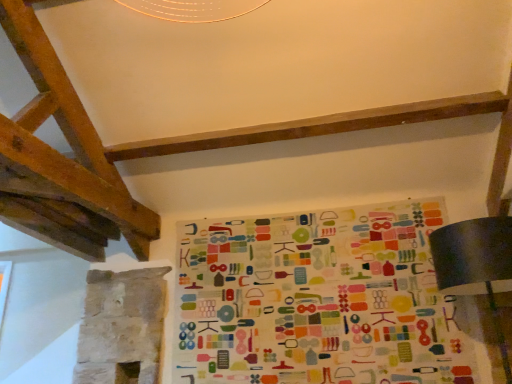
Question: Should I look upward or downward to see matte black lampshade at lower right?

Choices:
 (A) down
 (B) up

Answer: (A)

Question: Can you confirm if matte black lampshade at lower right is smaller than multicolored fabric at center?

Choices:
 (A) no
 (B) yes

Answer: (A)

Question: Is matte black lampshade at lower right closer to camera compared to multicolored fabric at center?

Choices:
 (A) yes
 (B) no

Answer: (A)

Question: From the image's perspective, would you say matte black lampshade at lower right is positioned over multicolored fabric at center?

Choices:
 (A) yes
 (B) no

Answer: (A)

Question: Can you confirm if matte black lampshade at lower right is positioned to the right of multicolored fabric at center?

Choices:
 (A) yes
 (B) no

Answer: (A)

Question: Considering the relative sizes of matte black lampshade at lower right and multicolored fabric at center in the image provided, is matte black lampshade at lower right shorter than multicolored fabric at center?

Choices:
 (A) yes
 (B) no

Answer: (A)

Question: Considering the relative positions of matte black lampshade at lower right and multicolored fabric at center in the image provided, is matte black lampshade at lower right to the left of multicolored fabric at center from the viewer's perspective?

Choices:
 (A) no
 (B) yes

Answer: (A)

Question: Could you tell me if multicolored fabric at center is facing matte black lampshade at lower right?

Choices:
 (A) no
 (B) yes

Answer: (B)

Question: Is matte black lampshade at lower right at the back of multicolored fabric at center?

Choices:
 (A) no
 (B) yes

Answer: (A)

Question: From the image's perspective, is multicolored fabric at center under matte black lampshade at lower right?

Choices:
 (A) no
 (B) yes

Answer: (B)

Question: From the image's perspective, is multicolored fabric at center on top of matte black lampshade at lower right?

Choices:
 (A) yes
 (B) no

Answer: (B)

Question: Can you confirm if multicolored fabric at center is positioned to the left of matte black lampshade at lower right?

Choices:
 (A) no
 (B) yes

Answer: (B)

Question: Is multicolored fabric at center positioned beyond the bounds of matte black lampshade at lower right?

Choices:
 (A) no
 (B) yes

Answer: (B)

Question: Considering the positions of matte black lampshade at lower right and multicolored fabric at center in the image, is matte black lampshade at lower right taller or shorter than multicolored fabric at center?

Choices:
 (A) tall
 (B) short

Answer: (B)